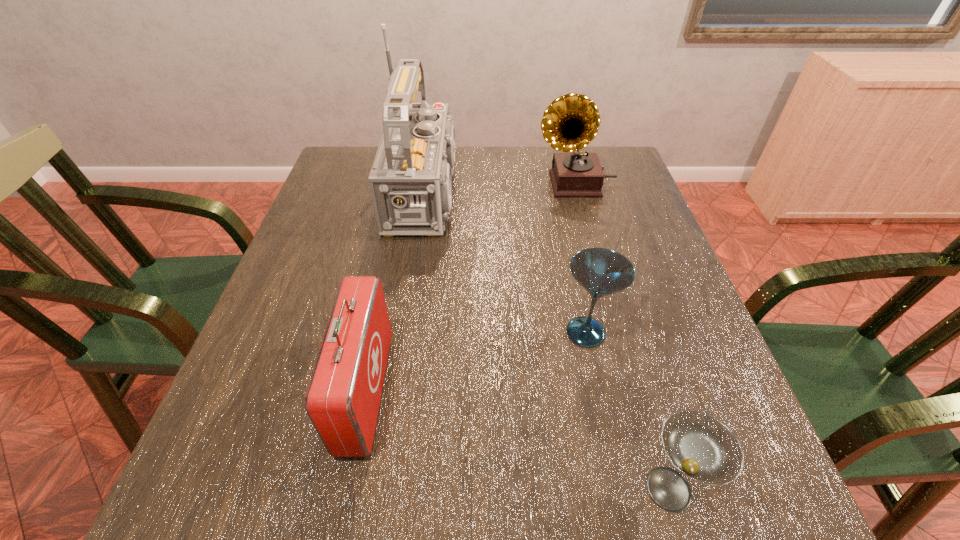
Where is `the tallest object`? the tallest object is located at coordinates (410, 181).

Where is `phonograph record`? phonograph record is located at coordinates (570, 122).

The height and width of the screenshot is (540, 960). I want to click on the third shortest object, so click(x=342, y=401).

Find the location of a particular element. the farther martini is located at coordinates (x=601, y=272).

Find the location of a particular element. The width and height of the screenshot is (960, 540). the nearer martini is located at coordinates (704, 449).

Locate an element on the screen. Image resolution: width=960 pixels, height=540 pixels. vacant space located on the front-facing side of the tallest object is located at coordinates (609, 193).

This screenshot has height=540, width=960. I want to click on free spot located 0.100m from the horn of the second tallest object, so click(499, 184).

Find the location of a particular element. free space located from the horn of the second tallest object is located at coordinates (414, 184).

This screenshot has height=540, width=960. I want to click on vacant region located 0.260m from the horn of the second tallest object, so click(443, 184).

At what (x,y) coordinates should I click in order to perform the action: click on vacant space located on the side of the third tallest object with the first aid cross symbol. Please return your answer as a coordinate pair (x, y). The width and height of the screenshot is (960, 540). Looking at the image, I should click on (531, 392).